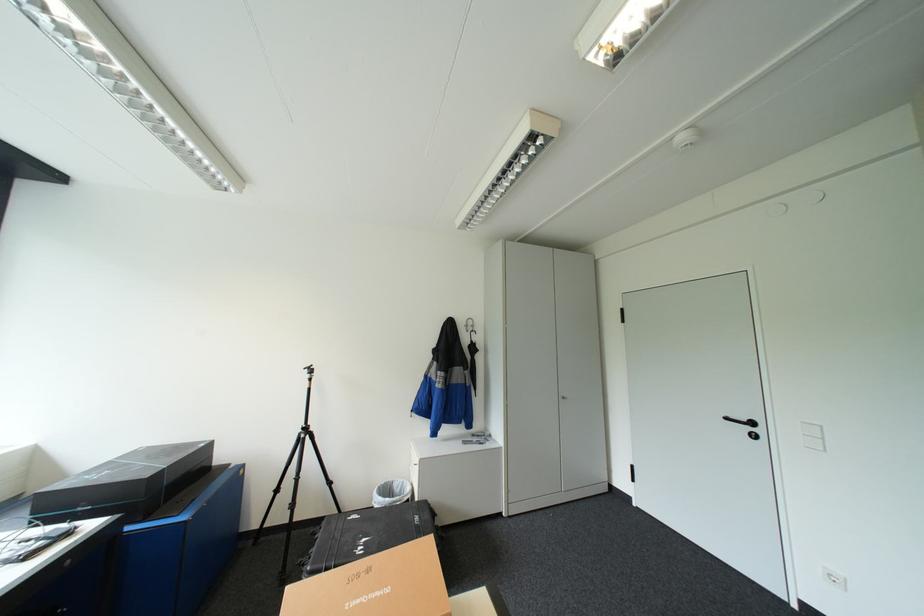
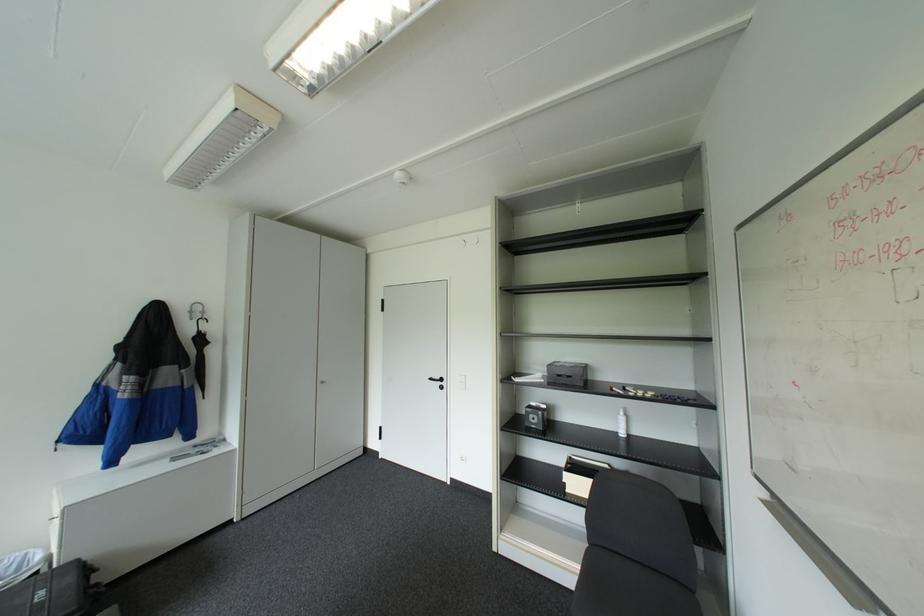
Find the pixel in the second image that matches point (735, 416) in the first image.

(439, 378)